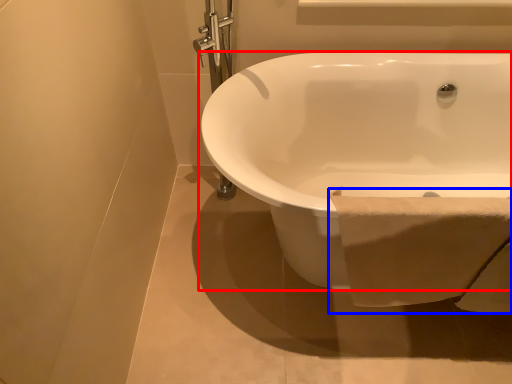
Question: Which object appears closest to the camera in this image, bathtub (highlighted by a red box) or toilet paper (highlighted by a blue box)?

Choices:
 (A) bathtub
 (B) toilet paper

Answer: (A)